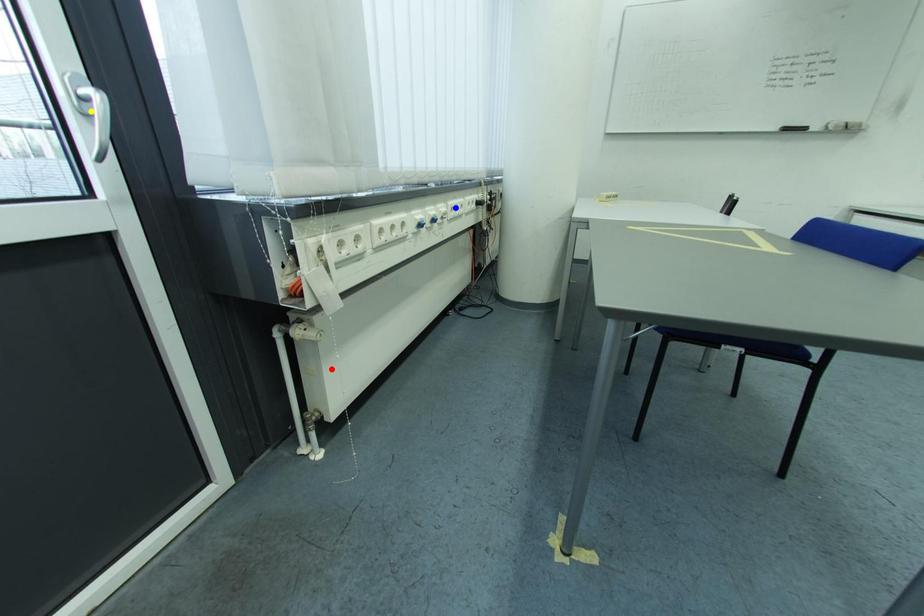
Order these from nearest to farthest:
A) blue point
B) yellow point
C) red point

red point → blue point → yellow point